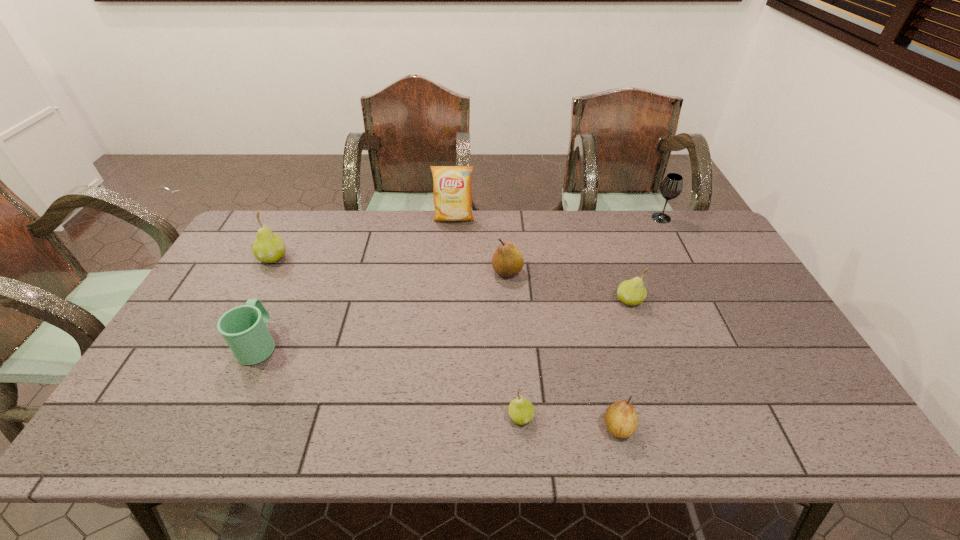
Where is `crisp (potato chip)`? Image resolution: width=960 pixels, height=540 pixels. crisp (potato chip) is located at coordinates (452, 189).

Locate an element on the screen. the tallest object is located at coordinates (452, 189).

You are a GUI agent. You are given a task and a screenshot of the screen. Output one action in this format:
    pyautogui.click(x=<x>, y=<y>)
    Task: Click on the gray wineglass
    
    Given the screenshot: What is the action you would take?
    pyautogui.click(x=671, y=187)

Identify the location of wineglass. (671, 187).

Where is `the tallest pear`? Image resolution: width=960 pixels, height=540 pixels. the tallest pear is located at coordinates (268, 247).

This screenshot has height=540, width=960. Find the location of `the farthest green pear`. the farthest green pear is located at coordinates (268, 247).

Identify the location of the bigger brown pear. The height and width of the screenshot is (540, 960). (507, 261).

Image resolution: width=960 pixels, height=540 pixels. I want to click on the left brown pear, so click(x=507, y=261).

Locate an element on the screen. the second biggest green pear is located at coordinates (632, 292).

Find the location of a particular element. This screenshot has width=960, height=540. the fifth farthest object is located at coordinates (632, 292).